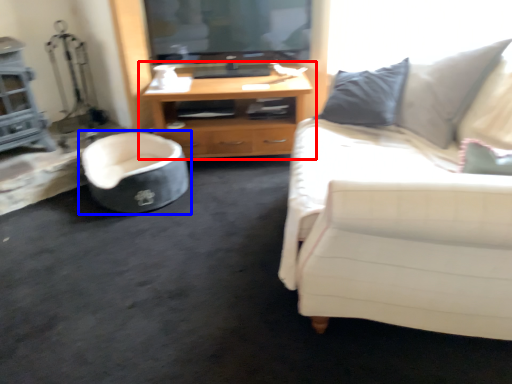
Question: Which object is closer to the camera taking this photo, cabinetry (highlighted by a red box) or chair (highlighted by a blue box)?

Choices:
 (A) cabinetry
 (B) chair

Answer: (B)